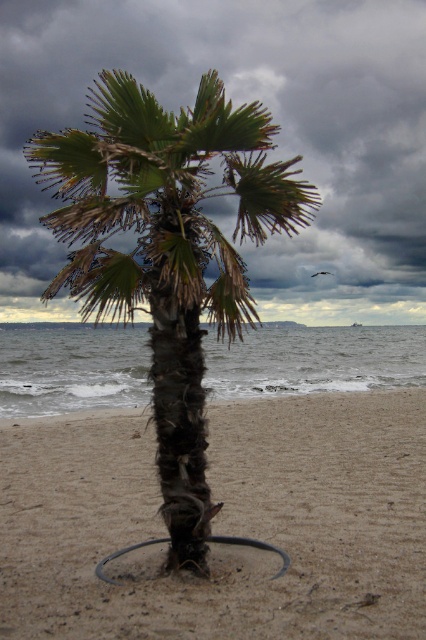
You are standing on the brown sandy beach at center and want to reach the green rough bark palm tree at center. Which direction should you move to get closer to the palm tree?

Since the brown sandy beach at center is located below the green rough bark palm tree at center, you should move upward to reach the palm tree.